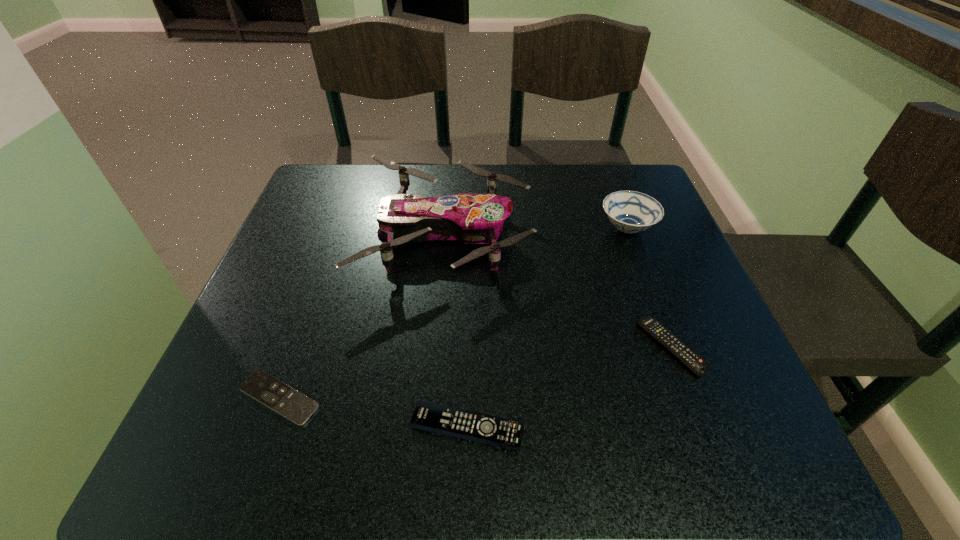
Identify the location of drone. The image size is (960, 540). (472, 218).

Locate an element on the screen. soup bowl is located at coordinates (629, 211).

Where is `the rightmost remote control`? the rightmost remote control is located at coordinates (668, 340).

Image resolution: width=960 pixels, height=540 pixels. Find the location of `the second remote control from left to right`. the second remote control from left to right is located at coordinates (492, 430).

The image size is (960, 540). What are the coordinates of `the shortest remote control` in the screenshot? It's located at (276, 395).

The width and height of the screenshot is (960, 540). Identify the location of the shortest object. (276, 395).

At what (x,y) coordinates should I click in order to perform the action: click on free region located on the front-facing side of the tallest object. Please return your answer as a coordinate pair (x, y). The image size is (960, 540). Looking at the image, I should click on (649, 234).

At what (x,y) coordinates should I click in order to perform the action: click on free space located on the front of the soup bowl. Please return your answer as a coordinate pair (x, y). Looking at the image, I should click on [x=654, y=301].

The height and width of the screenshot is (540, 960). I want to click on vacant space located on the back of the rightmost remote control, so click(638, 261).

Where is `vacant space situated on the right of the second remote control from left to right`? The image size is (960, 540). vacant space situated on the right of the second remote control from left to right is located at coordinates (647, 427).